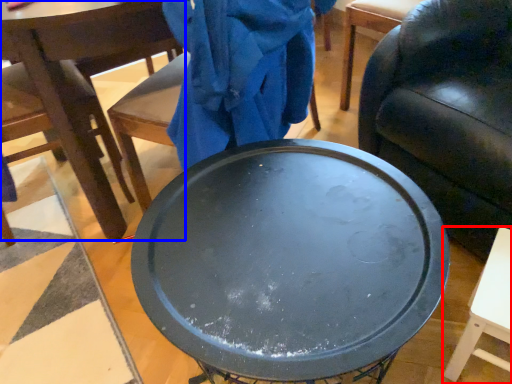
Question: Which object is closer to the camera taking this photo, table (highlighted by a red box) or chair (highlighted by a blue box)?

Choices:
 (A) table
 (B) chair

Answer: (A)